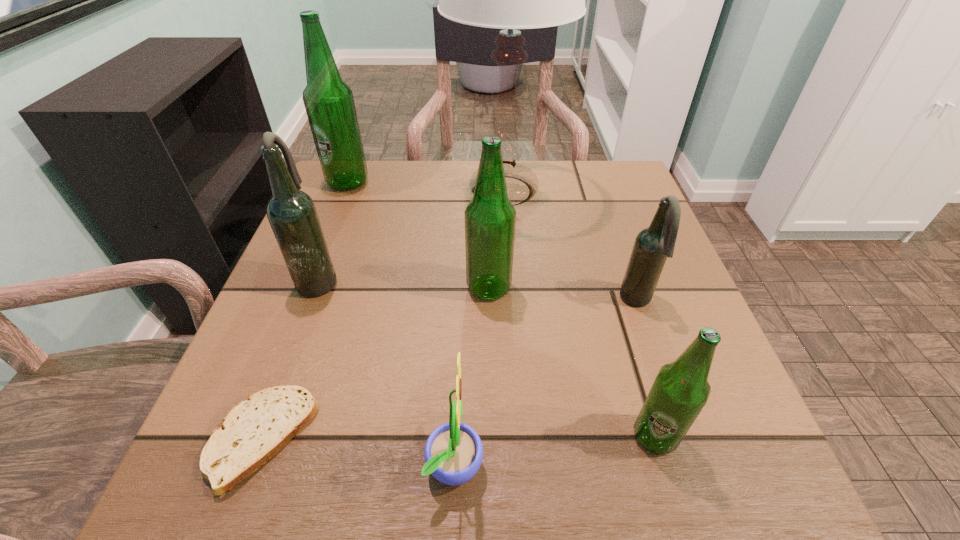
Locate an element on the screen. The height and width of the screenshot is (540, 960). pita bread is located at coordinates (253, 431).

The image size is (960, 540). I want to click on vacant position located on the front-facing side of the table lamp, so click(370, 191).

This screenshot has height=540, width=960. Find the location of `free point located on the front-facing side of the table lamp`. free point located on the front-facing side of the table lamp is located at coordinates (377, 191).

The height and width of the screenshot is (540, 960). Find the location of `free space located 0.230m on the front-facing side of the table lamp`. free space located 0.230m on the front-facing side of the table lamp is located at coordinates click(x=353, y=191).

Find the location of `free space located on the label of the farthest green beer bottle`. free space located on the label of the farthest green beer bottle is located at coordinates (315, 264).

In order to click on free point located on the label of the second farthest green beer bottle in this screenshot , I will do `click(414, 288)`.

The image size is (960, 540). In order to click on free spot located on the label of the second farthest green beer bottle in this screenshot , I will do `click(318, 288)`.

The image size is (960, 540). I want to click on free space located 0.060m on the label of the second farthest green beer bottle, so click(x=435, y=288).

Where is `vacant region located 0.300m on the right of the bigger dark beer bottle`? vacant region located 0.300m on the right of the bigger dark beer bottle is located at coordinates (495, 279).

Locate an element on the screen. This screenshot has height=540, width=960. vacant space situated on the left of the smaller dark beer bottle is located at coordinates (435, 301).